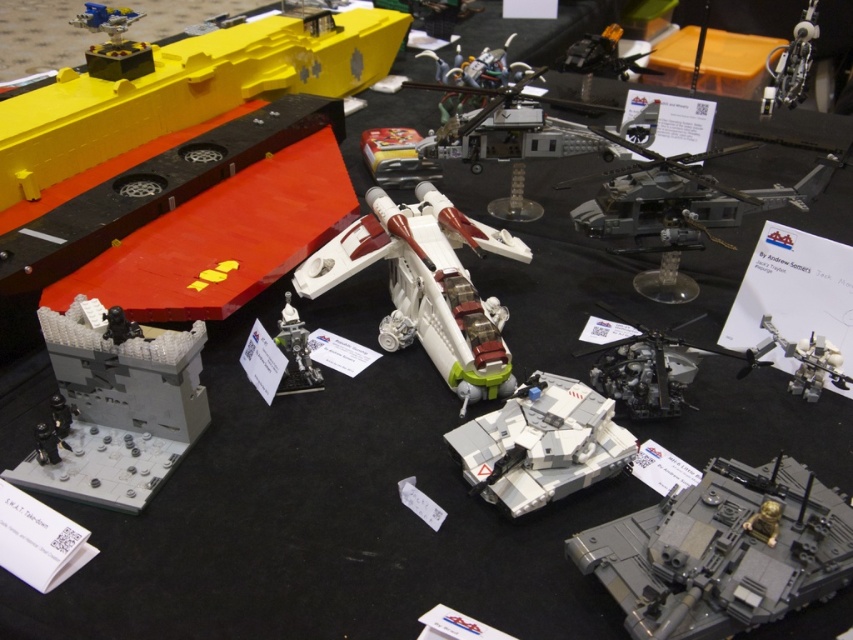
Question: Is metallic silver helicopter at upper right to the left of shiny black helicopter at upper center from the viewer's perspective?

Choices:
 (A) no
 (B) yes

Answer: (A)

Question: Which object appears farthest from the camera in this image?

Choices:
 (A) metallic silver robot at center
 (B) gray matte brick wall at lower left
 (C) white plastic tank at center
 (D) shiny blue plastic spaceship at upper left

Answer: (D)

Question: Which object is positioned closest to the shiny blue plastic spaceship at upper left?

Choices:
 (A) matte plastic toy car at center
 (B) dark gray metallic tank at lower right

Answer: (A)

Question: Estimate the real-world distances between objects in this image. Which object is farther from the white plastic helicopter at center?

Choices:
 (A) silver metallic figure at center
 (B) white plastic tank at center
 (C) shiny black helicopter at upper center
 (D) metallic gray helicopter at upper right

Answer: (C)

Question: Can you confirm if white plastic tank at center is bigger than shiny black helicopter at upper center?

Choices:
 (A) no
 (B) yes

Answer: (A)

Question: Does shiny blue plastic spaceship at upper left appear under metallic silver robot at center?

Choices:
 (A) yes
 (B) no

Answer: (B)